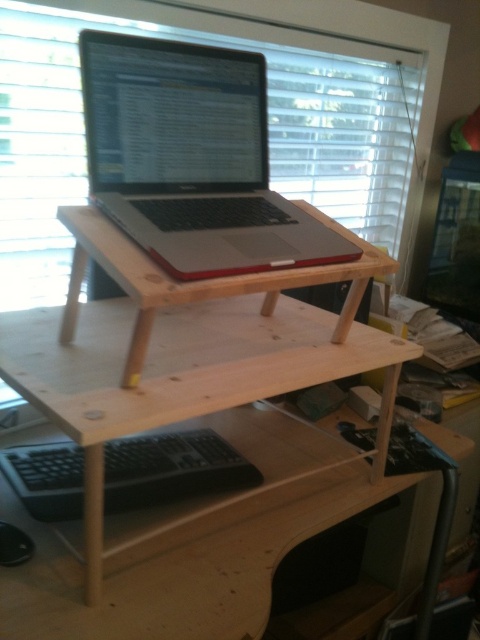
Between black matte keyboard at lower center and natural wood laptop stand at center, which one is positioned higher?

Positioned higher is natural wood laptop stand at center.

Can you confirm if black matte keyboard at lower center is positioned below natural wood laptop stand at center?

Yes.

Who is more distant from viewer, [140,435] or [156,301]?

The point [140,435] is more distant.

Locate an element on the screen. This screenshot has width=480, height=640. black matte keyboard at lower center is located at coordinates (171, 468).

Is satin silver laptop at center smaller than natural wood laptop stand at center?

Yes, satin silver laptop at center is smaller than natural wood laptop stand at center.

Is point (215, 268) positioned before point (286, 276)?

Yes, point (215, 268) is closer to viewer.

Where is `satin silver laptop at center`? The width and height of the screenshot is (480, 640). satin silver laptop at center is located at coordinates (192, 157).

Does satin silver laptop at center have a lesser width compared to black matte keyboard at lower center?

Yes.

Between satin silver laptop at center and black matte keyboard at lower center, which one has less height?

black matte keyboard at lower center

Is point (99, 81) farther from camera compared to point (228, 464)?

That is False.

You are a GUI agent. You are given a task and a screenshot of the screen. Output one action in this format:
    pyautogui.click(x=<x>, y=<y>)
    Task: Click on the satin silver laptop at center
    The height and width of the screenshot is (640, 480).
    Given the screenshot: What is the action you would take?
    pyautogui.click(x=192, y=157)